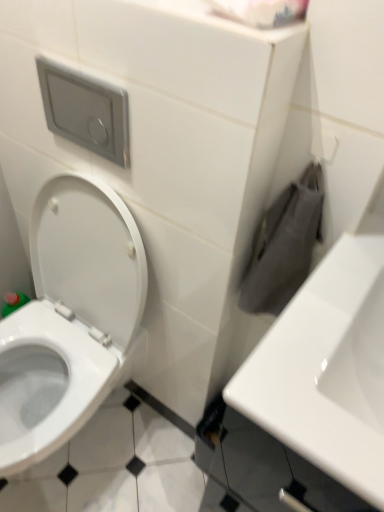
Question: Is white glossy toilet at left at the back of white glossy sink at right?

Choices:
 (A) yes
 (B) no

Answer: (B)

Question: From a real-world perspective, is white glossy sink at right beneath white glossy toilet at left?

Choices:
 (A) no
 (B) yes

Answer: (A)

Question: Does white glossy sink at right lie behind white glossy toilet at left?

Choices:
 (A) no
 (B) yes

Answer: (A)

Question: Can you confirm if white glossy sink at right is thinner than white glossy toilet at left?

Choices:
 (A) no
 (B) yes

Answer: (B)

Question: Is white glossy sink at right positioned beyond the bounds of white glossy toilet at left?

Choices:
 (A) yes
 (B) no

Answer: (A)

Question: In terms of height, does white matte toilet paper at upper center look taller or shorter compared to white glossy toilet at left?

Choices:
 (A) short
 (B) tall

Answer: (A)

Question: From a real-world perspective, is white matte toilet paper at upper center above or below white glossy toilet at left?

Choices:
 (A) above
 (B) below

Answer: (A)

Question: In the image, is white matte toilet paper at upper center positioned in front of or behind white glossy toilet at left?

Choices:
 (A) behind
 (B) front

Answer: (B)

Question: Is white matte toilet paper at upper center bigger or smaller than white glossy toilet at left?

Choices:
 (A) big
 (B) small

Answer: (B)

Question: Visually, is white matte toilet paper at upper center positioned to the left or to the right of white glossy sink at right?

Choices:
 (A) left
 (B) right

Answer: (A)

Question: In terms of width, does white matte toilet paper at upper center look wider or thinner when compared to white glossy sink at right?

Choices:
 (A) thin
 (B) wide

Answer: (A)

Question: From a real-world perspective, is white matte toilet paper at upper center positioned above or below white glossy sink at right?

Choices:
 (A) below
 (B) above

Answer: (B)

Question: Does point (302, 0) appear closer or farther from the camera than point (268, 411)?

Choices:
 (A) closer
 (B) farther

Answer: (B)

Question: Is white glossy toilet at left spatially inside white matte toilet paper at upper center, or outside of it?

Choices:
 (A) outside
 (B) inside

Answer: (A)

Question: Based on their sizes in the image, would you say white glossy toilet at left is bigger or smaller than white matte toilet paper at upper center?

Choices:
 (A) small
 (B) big

Answer: (B)